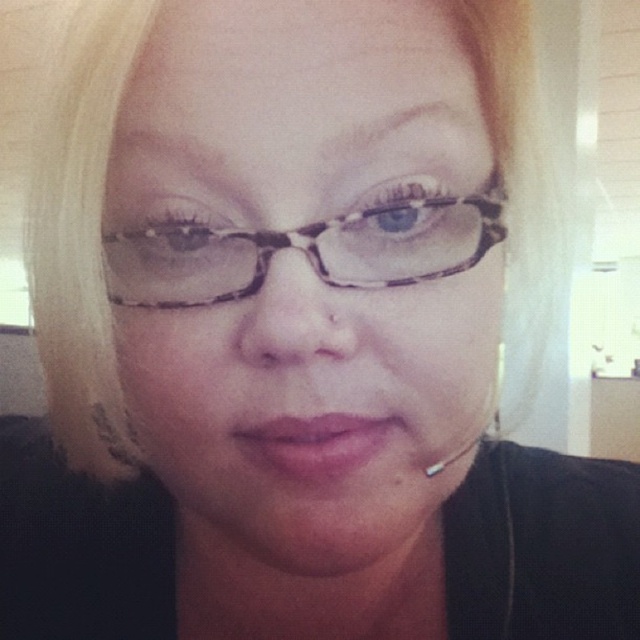
Is matte black glasses at center wider than translucent tortoiseshell glasses at center?

Correct, the width of matte black glasses at center exceeds that of translucent tortoiseshell glasses at center.

Is point (237, 108) closer to camera compared to point (209, 296)?

Yes.

This screenshot has width=640, height=640. Find the location of `matte black glasses at center`. matte black glasses at center is located at coordinates (298, 273).

Looking at this image, does translucent tortoiseshell glasses at center appear over pink matte lips at center?

Indeed, translucent tortoiseshell glasses at center is positioned over pink matte lips at center.

Which is above, translucent tortoiseshell glasses at center or pink matte lips at center?

translucent tortoiseshell glasses at center

Is point (230, 237) farther from camera compared to point (266, 433)?

No, (230, 237) is in front of (266, 433).

The width and height of the screenshot is (640, 640). In order to click on translucent tortoiseshell glasses at center in this screenshot , I will do click(x=305, y=250).

Measure the distance between matte black glasses at center and pink matte lips at center.

matte black glasses at center and pink matte lips at center are 2.17 inches apart from each other.

Describe the element at coordinates (298, 273) in the screenshot. I see `matte black glasses at center` at that location.

Does point (428, 35) come behind point (310, 438)?

No, (428, 35) is in front of (310, 438).

Identify the location of matte black glasses at center. The width and height of the screenshot is (640, 640). (298, 273).